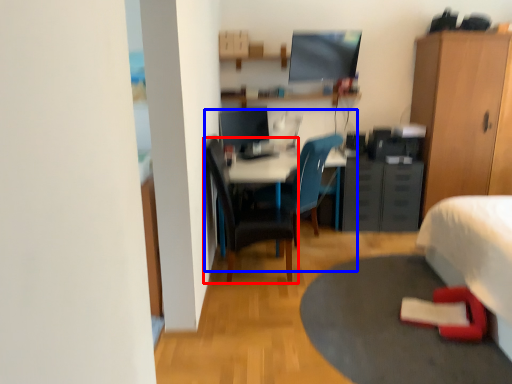
Question: Which object is further to the camera taking this photo, chair (highlighted by a red box) or computer desk (highlighted by a blue box)?

Choices:
 (A) chair
 (B) computer desk

Answer: (B)